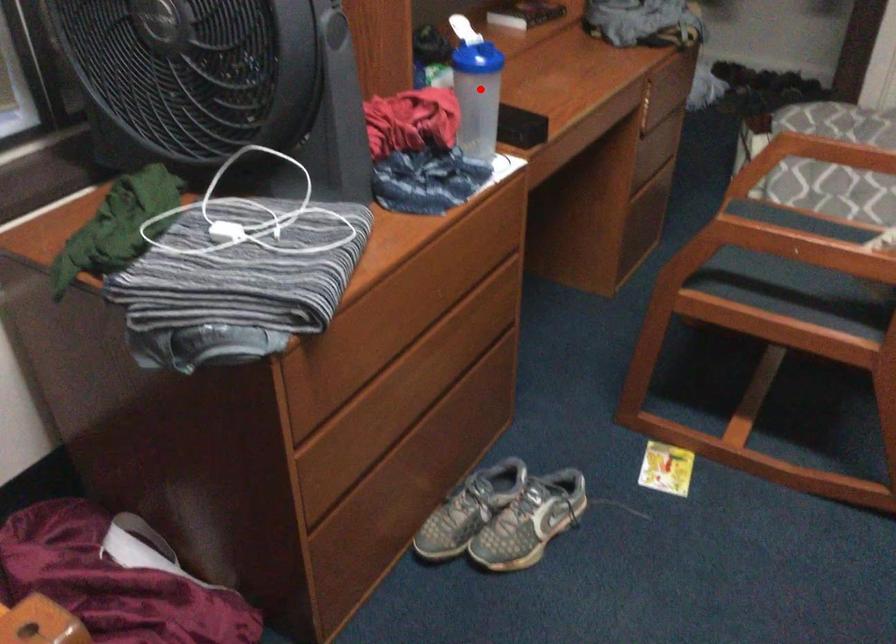
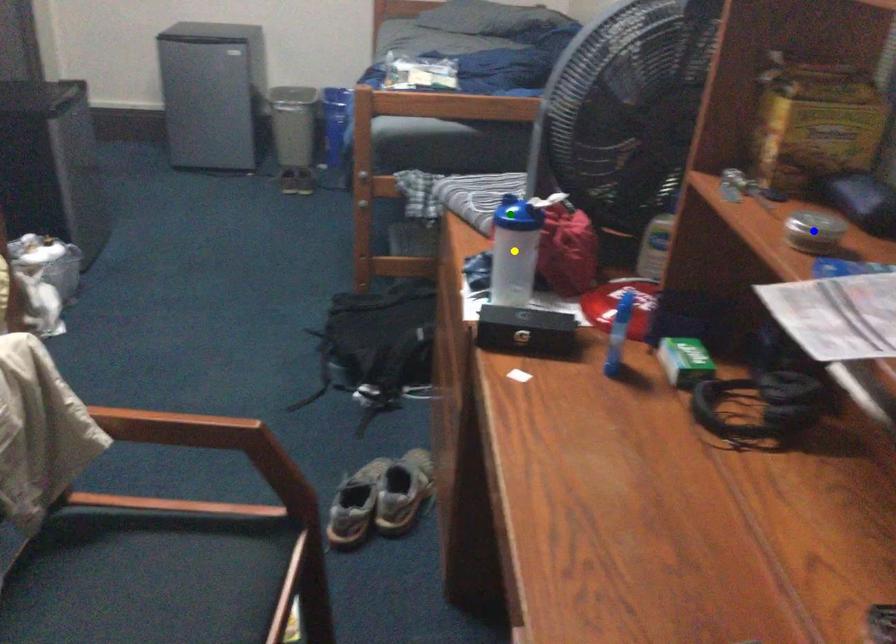
Question: I am providing you with two images of the same scene from different viewpoints. A red point is marked on the first image. You are given multiple points on the second image. Which mark in image 2 goes with the point in image 1?

Choices:
 (A) blue point
 (B) yellow point
 (C) green point

Answer: (B)